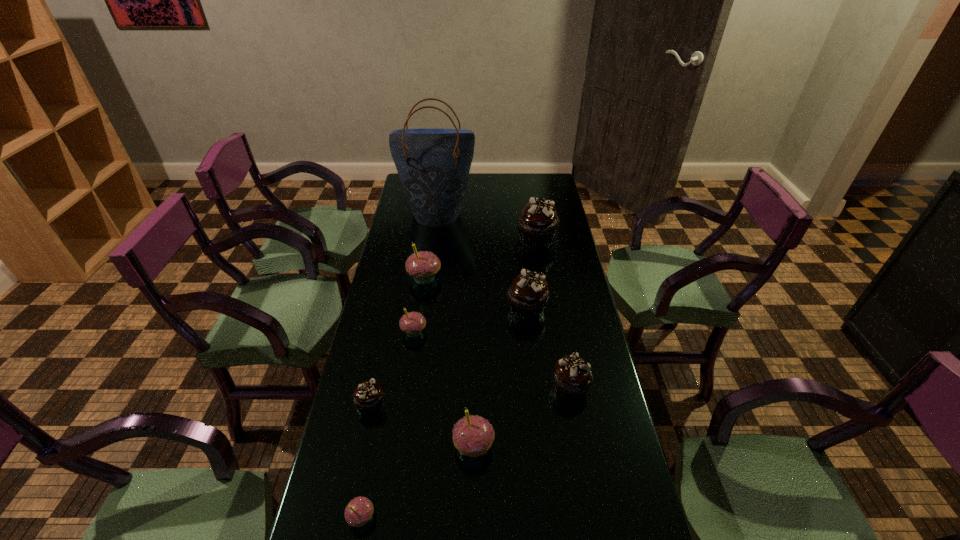
This screenshot has width=960, height=540. I want to click on brown cupcake that stands as the third closest to the third nearest pink cupcake, so coord(572,378).

Identify which pink cupcake is the fourth closest to the smallest brown cupcake. Please provide its 2D coordinates. Your answer should be formatted as a tuple, i.e. [(x, y)], where the tuple contains the x and y coordinates of a point satisfying the conditions above.

[(422, 265)]

Identify the location of the third closest pink cupcake to the tallest object. (473, 435).

Locate an element on the screen. The width and height of the screenshot is (960, 540). free point that satisfies the following two spatial constraints: 1. on the back side of the fifth cupcake from left to right; 2. on the right side of the nearest object is located at coordinates (375, 447).

Identify the location of free space that satisfies the following two spatial constraints: 1. on the back side of the second smallest pink cupcake; 2. on the left side of the shopping bag. Image resolution: width=960 pixels, height=540 pixels. (432, 213).